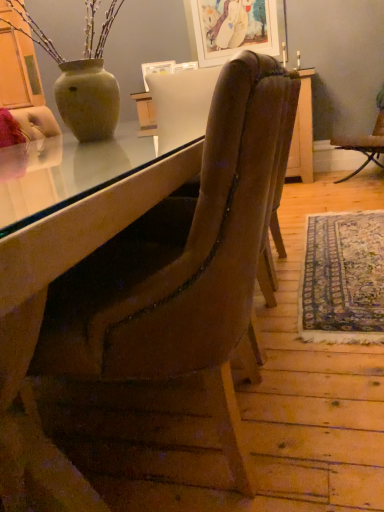
Question: From a real-world perspective, does matte white picture frame at upper center stand above blue patterned rug at lower right?

Choices:
 (A) no
 (B) yes

Answer: (B)

Question: From the image's perspective, is matte white picture frame at upper center beneath blue patterned rug at lower right?

Choices:
 (A) no
 (B) yes

Answer: (A)

Question: From a real-world perspective, is matte white picture frame at upper center below blue patterned rug at lower right?

Choices:
 (A) no
 (B) yes

Answer: (A)

Question: Does matte white picture frame at upper center appear on the left side of blue patterned rug at lower right?

Choices:
 (A) yes
 (B) no

Answer: (A)

Question: Does matte white picture frame at upper center have a lesser width compared to blue patterned rug at lower right?

Choices:
 (A) no
 (B) yes

Answer: (B)

Question: Considering the relative sizes of matte white picture frame at upper center and blue patterned rug at lower right in the image provided, is matte white picture frame at upper center smaller than blue patterned rug at lower right?

Choices:
 (A) yes
 (B) no

Answer: (B)

Question: Is the position of matte white picture frame at upper center more distant than that of velvet brown chair at center, which ranks as the first chair in front-to-back order?

Choices:
 (A) yes
 (B) no

Answer: (A)

Question: Considering the relative sizes of matte white picture frame at upper center and velvet brown chair at center, which ranks as the first chair in front-to-back order, in the image provided, is matte white picture frame at upper center thinner than velvet brown chair at center, which ranks as the first chair in front-to-back order,?

Choices:
 (A) yes
 (B) no

Answer: (A)

Question: From the image's perspective, would you say matte white picture frame at upper center is positioned over velvet brown chair at center, positioned as the second chair in right-to-left order?

Choices:
 (A) yes
 (B) no

Answer: (A)

Question: Could you tell me if matte white picture frame at upper center is turned towards velvet brown chair at center, positioned as the second chair in right-to-left order?

Choices:
 (A) yes
 (B) no

Answer: (A)

Question: Would you consider matte white picture frame at upper center to be distant from velvet brown chair at center, which is the 2th chair from top to bottom?

Choices:
 (A) yes
 (B) no

Answer: (A)

Question: Is matte white picture frame at upper center outside of velvet brown chair at center, which is the first chair in left-to-right order?

Choices:
 (A) no
 (B) yes

Answer: (B)

Question: From the image's perspective, is velvet brown chair at center, which appears as the first chair when ordered from the bottom, below matte white picture frame at upper center?

Choices:
 (A) no
 (B) yes

Answer: (B)